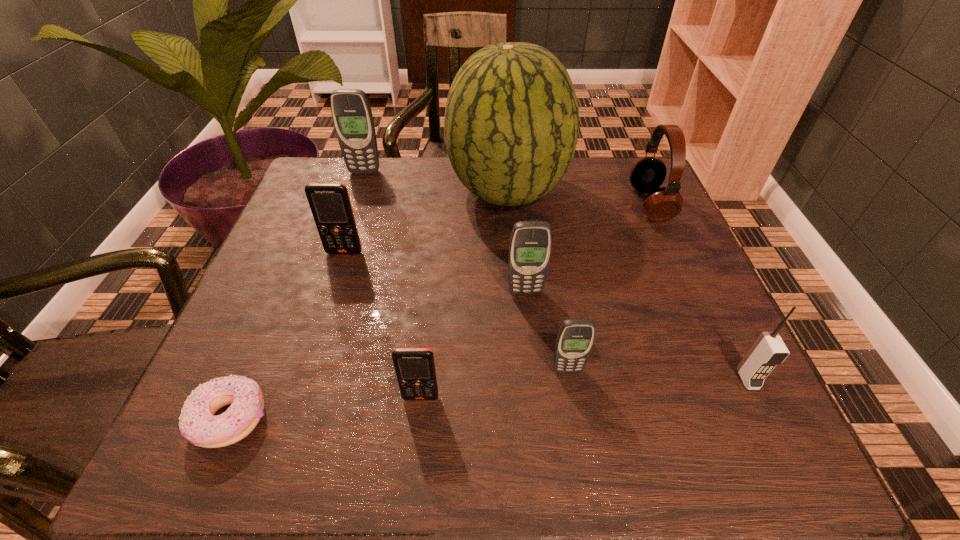
Identify the location of the nearest cellular telephone. Image resolution: width=960 pixels, height=540 pixels. (415, 369).

Where is `the nearer orange cellular telephone`? the nearer orange cellular telephone is located at coordinates (415, 369).

The image size is (960, 540). In order to click on the smallest gray cellular telephone in this screenshot , I will do click(575, 338).

Identify the location of purple doughnut. The width and height of the screenshot is (960, 540). (198, 425).

The width and height of the screenshot is (960, 540). In order to click on the shortest object in this screenshot , I will do `click(198, 425)`.

Image resolution: width=960 pixels, height=540 pixels. I want to click on free spot located on the front of the watermelon, so click(x=513, y=255).

Identify the location of vacant point located 0.250m on the screen of the farthest cellular telephone. (344, 235).

You are a GUI agent. You are given a task and a screenshot of the screen. Output one action in this format:
    pyautogui.click(x=<x>, y=<y>)
    Task: Click on the free space located on the ear pads of the headset
    This screenshot has height=540, width=960.
    Given the screenshot: What is the action you would take?
    pyautogui.click(x=612, y=204)

You are a GUI agent. You are given a task and a screenshot of the screen. Output one action in this format:
    pyautogui.click(x=<x>, y=<y>)
    Task: Click on the vacant space located on the ear pads of the headset
    The width and height of the screenshot is (960, 540).
    Given the screenshot: What is the action you would take?
    pyautogui.click(x=503, y=204)

What are the coordinates of `vacant region located 0.260m on the ear pads of the headset` in the screenshot? It's located at (527, 204).